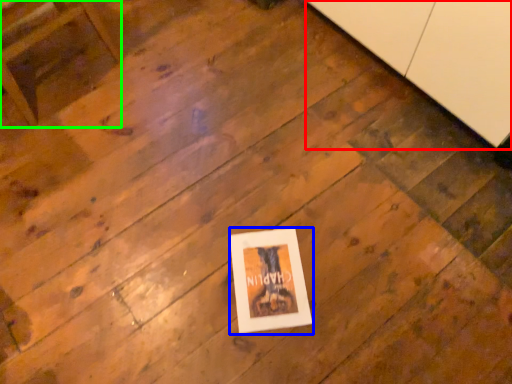
Question: Which object is positioned farthest from cabinetry (highlighted by a red box)? Select from picture frame (highlighted by a blue box) and furniture (highlighted by a green box).

Choices:
 (A) picture frame
 (B) furniture

Answer: (B)